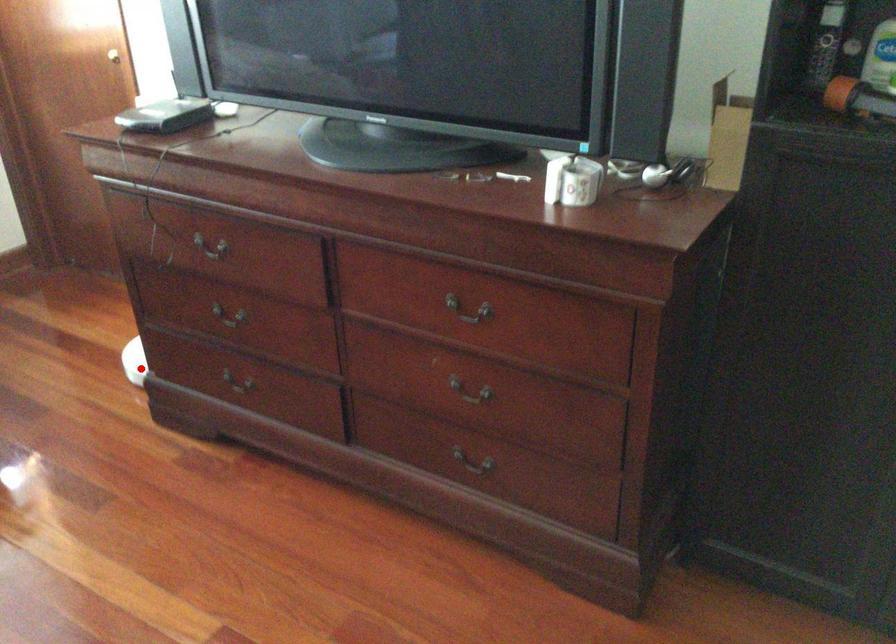
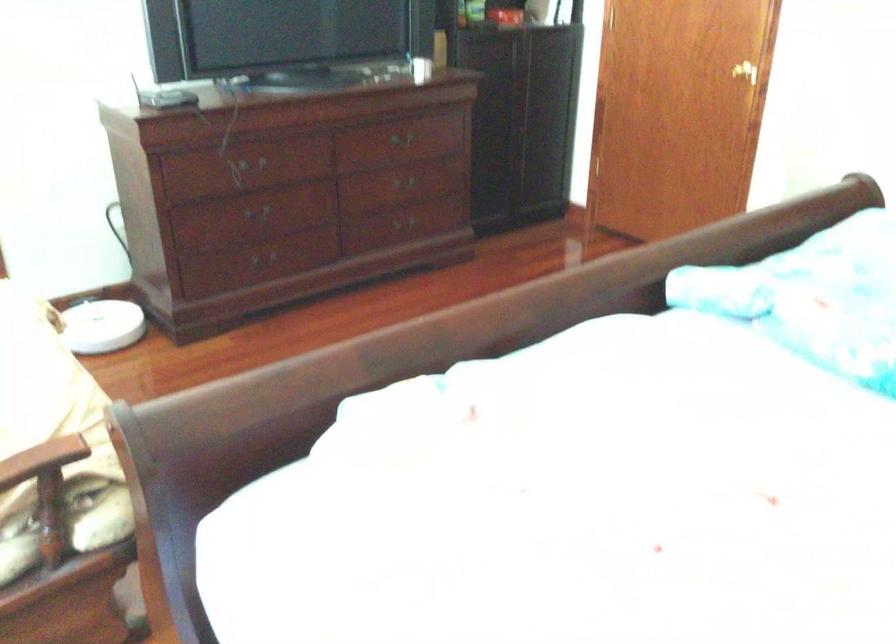
Find the pixel in the second image that matches the highlighted location in the first image.

(101, 326)